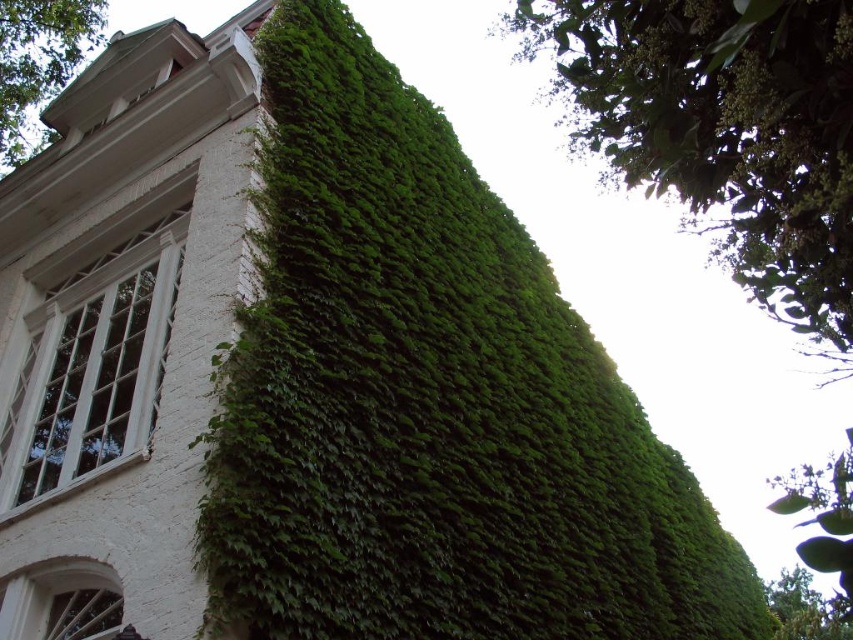
Question: Estimate the real-world distances between objects in this image. Which object is closer to the green leafy ivy at upper left?

Choices:
 (A) white painted wood window at left
 (B) white glass window at lower left

Answer: (A)

Question: Is green leafy tree at upper right smaller than white painted wood window at left?

Choices:
 (A) yes
 (B) no

Answer: (B)

Question: Which point appears farthest from the camera in this image?

Choices:
 (A) (73, 4)
 (B) (212, 596)
 (C) (711, 13)

Answer: (A)

Question: Does white painted wood window at left lie in front of white glass window at lower left?

Choices:
 (A) no
 (B) yes

Answer: (A)

Question: Among these points, which one is farthest from the camera?

Choices:
 (A) (659, 164)
 (B) (70, 598)

Answer: (A)

Question: Can you confirm if white painted wood window at left is positioned to the left of white glass window at lower left?

Choices:
 (A) no
 (B) yes

Answer: (B)